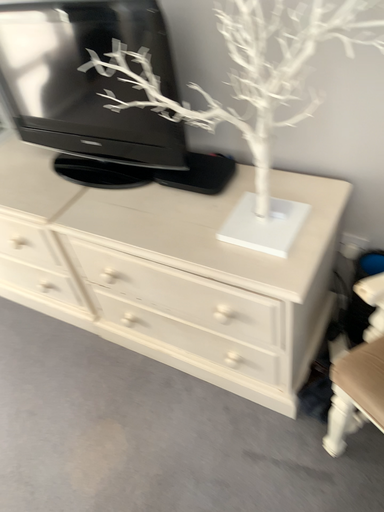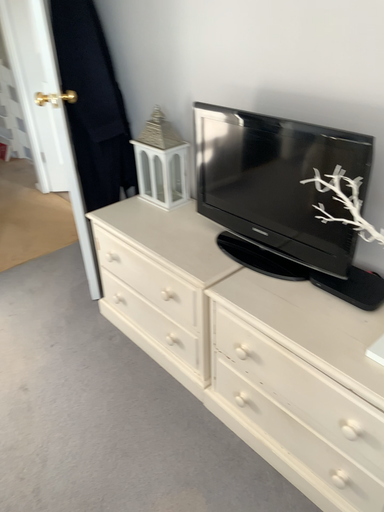
Question: Which way did the camera rotate in the video?

Choices:
 (A) rotated left
 (B) rotated right

Answer: (A)